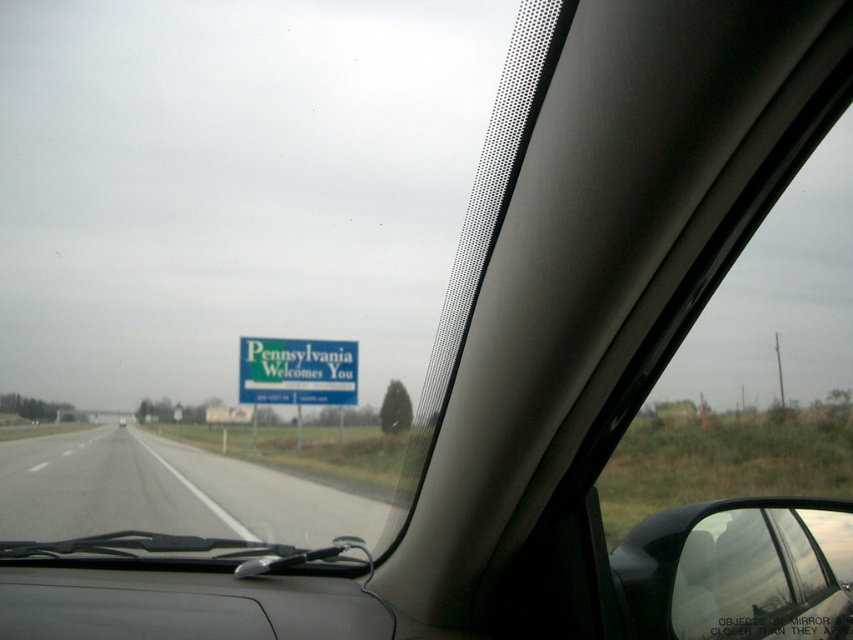
Question: Is gray asphalt highway at center positioned behind green matte signboard at center?

Choices:
 (A) yes
 (B) no

Answer: (B)

Question: Observing the image, what is the correct spatial positioning of gray asphalt highway at center in reference to green matte signboard at center?

Choices:
 (A) left
 (B) right

Answer: (A)

Question: Does gray asphalt highway at center have a greater width compared to green matte signboard at center?

Choices:
 (A) yes
 (B) no

Answer: (A)

Question: Which point appears farthest from the camera in this image?

Choices:
 (A) (54, 477)
 (B) (276, 376)

Answer: (B)